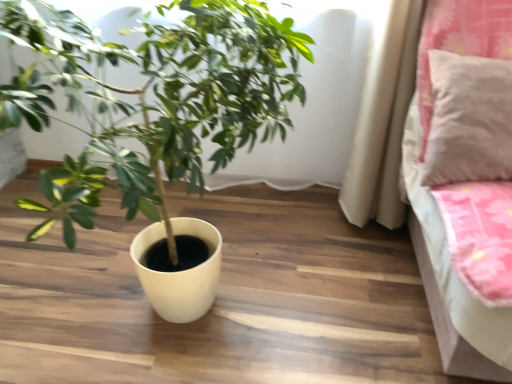
The image size is (512, 384). What are the coordinates of `vacant space in matte white pot at center (from a real-world perspective)` in the screenshot? It's located at (127, 294).